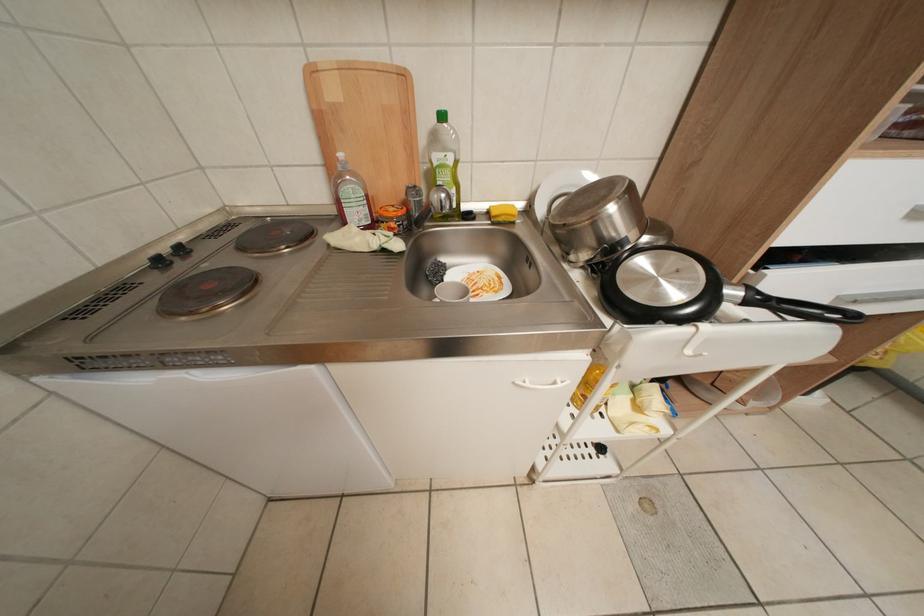
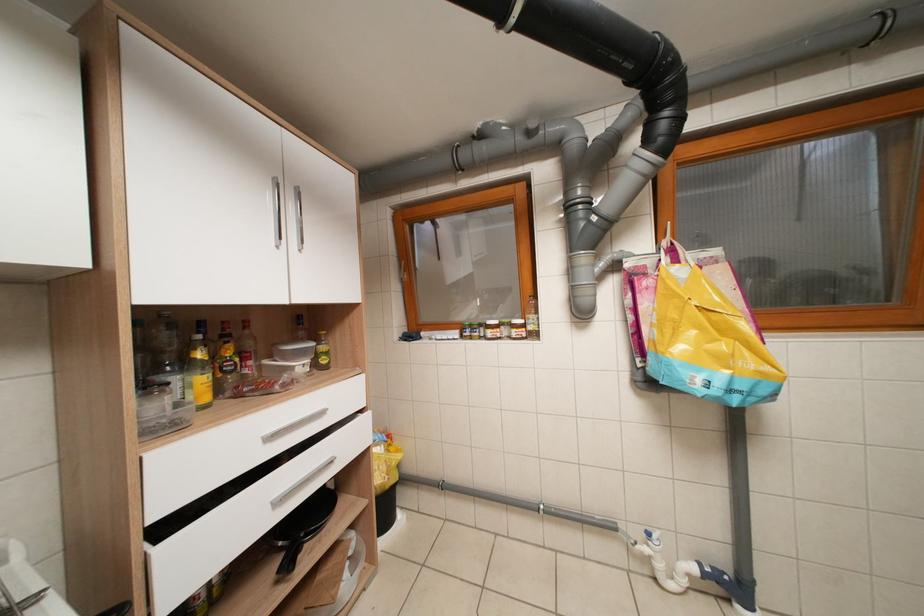
Looking at this image, how did the camera likely rotate?

The camera rotated toward right-up.